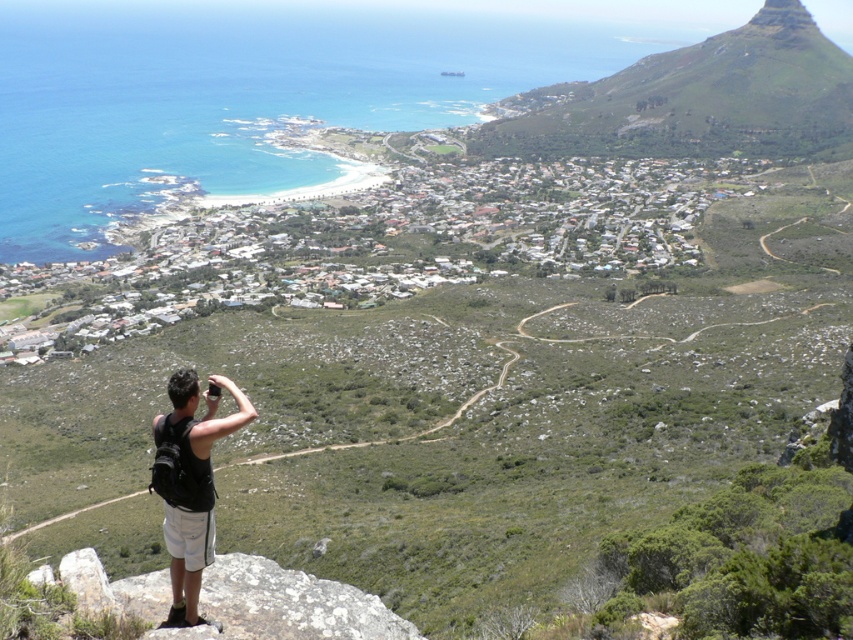
Question: Which object appears farthest from the camera in this image?

Choices:
 (A) black fabric backpack at lower left
 (B) green grassy mountain at upper right

Answer: (B)

Question: Does green grassy mountain at upper right have a smaller size compared to black fabric backpack at lower left?

Choices:
 (A) yes
 (B) no

Answer: (B)

Question: In this image, where is green grassy mountain at upper right located relative to black fabric backpack at lower left?

Choices:
 (A) above
 (B) below

Answer: (A)

Question: Which point is closer to the camera?

Choices:
 (A) black fabric backpack at lower left
 (B) green grassy mountain at upper right

Answer: (A)

Question: Which point is closer to the camera?

Choices:
 (A) (619, 93)
 (B) (189, 596)

Answer: (B)

Question: Is green grassy mountain at upper right wider than black fabric backpack at lower left?

Choices:
 (A) yes
 (B) no

Answer: (A)